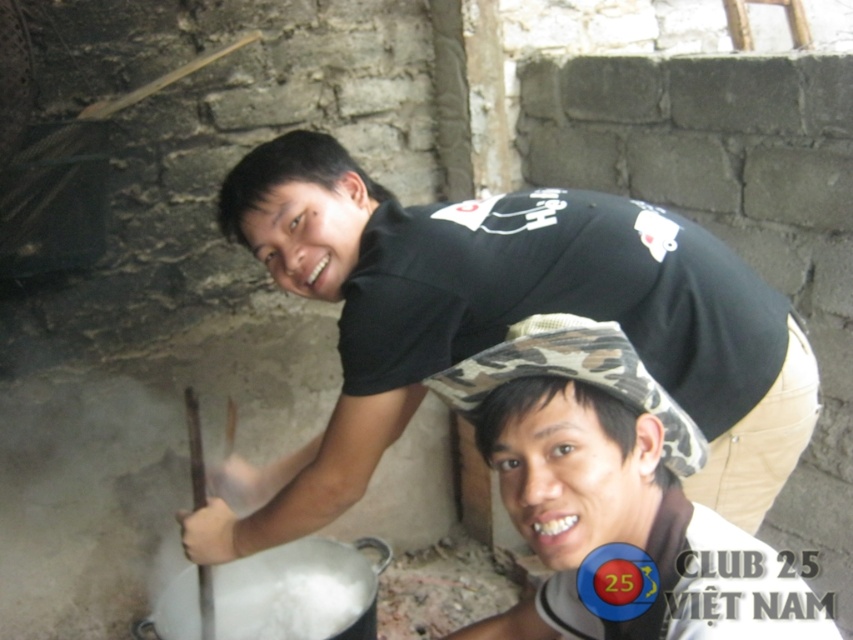
You are a photographer taking a picture of the scene. The black matte shirt at upper center and the camouflage hat at center are both in your frame. Which object should you focus on if you want to capture the taller one?

The black matte shirt at upper center is taller than the camouflage hat at center, so focus on the black matte shirt at upper center to capture the taller one.

You are standing in the rustic kitchen scene. You need to locate the black matte shirt at upper center. According to the coordinates given, where exactly is it positioned?

The black matte shirt at upper center is positioned at coordinates point (497,324).